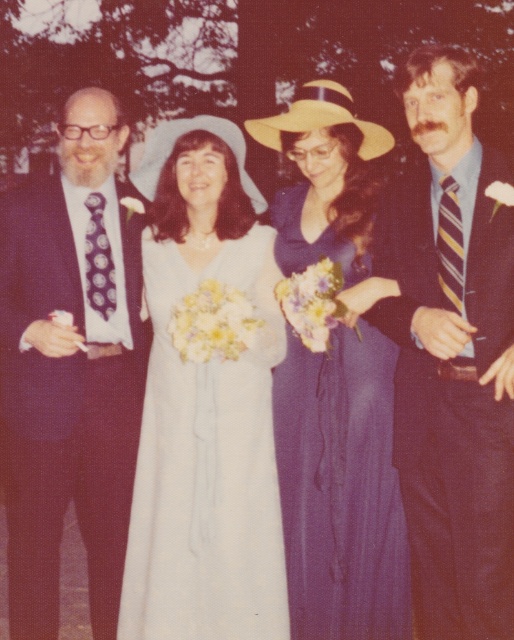
Based on the photo, you are a photographer at a wedding. You need to position the white satin dress at center and the purple satin dress at center so that both dresses are visible in the photo. Which dress should you place closer to the camera to ensure both are fully visible?

The white satin dress at center is much taller than the purple satin dress at center, so you should place the white satin dress at center closer to the camera to ensure both dresses are fully visible.

You are a photographer at a wedding. You need to adjust the lighting so that the white satin dress at center and the purple satin dress at center are both well lit. Which dress should you focus the light on first to ensure both are properly illuminated?

The white satin dress at center is above the purple satin dress at center, so you should focus the light on the white satin dress at center first. This way, the light will naturally cascade downward, illuminating both dresses effectively.

You are a photographer at a wedding. You need to adjust the lighting so that the striped tie at right and the purple satin dress at center are both well lit. Which object should you focus on first to ensure both are properly illuminated?

The striped tie at right is closer to the viewer than the purple satin dress at center, so you should focus on lighting the striped tie at right first to ensure proper illumination for both.